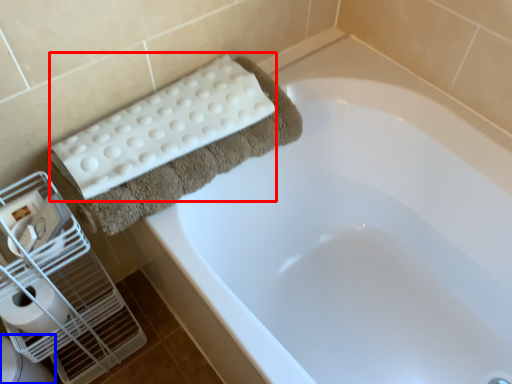
Question: Which point is closer to the camera, bath towel (highlighted by a red box) or toilet bowl (highlighted by a blue box)?

Choices:
 (A) bath towel
 (B) toilet bowl

Answer: (A)